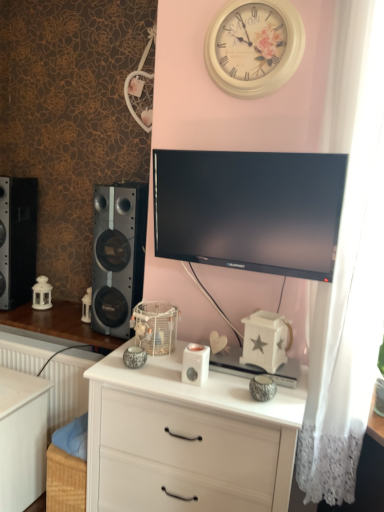
The width and height of the screenshot is (384, 512). I want to click on vacant space to the left of white plastic ipod at center, so click(x=154, y=374).